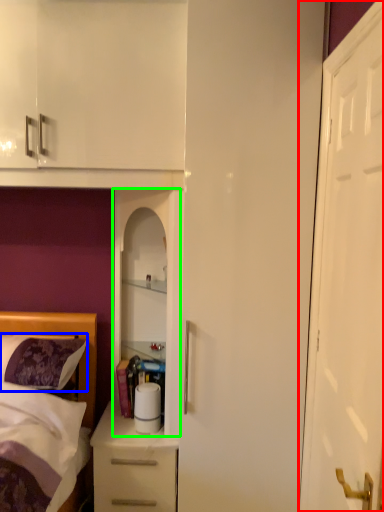
Question: Which is farther away from door (highlighted by a red box)? pillow (highlighted by a blue box) or cabinetry (highlighted by a green box)?

Choices:
 (A) pillow
 (B) cabinetry

Answer: (A)